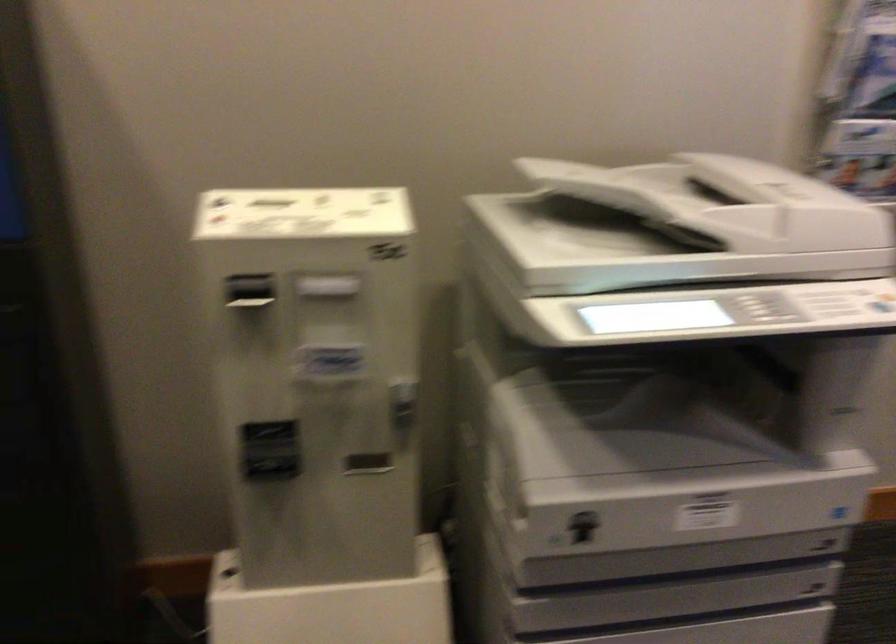
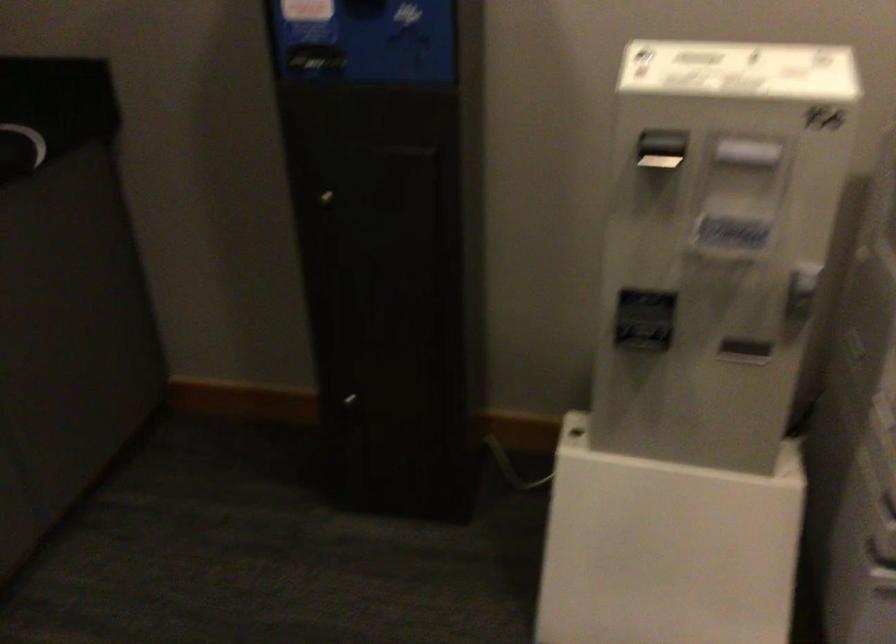
Question: Which direction would the cameraman need to move to produce the second image? Reply with the corresponding letter.

Choices:
 (A) Left
 (B) Right
 (C) Forward
 (D) Backward

Answer: (A)